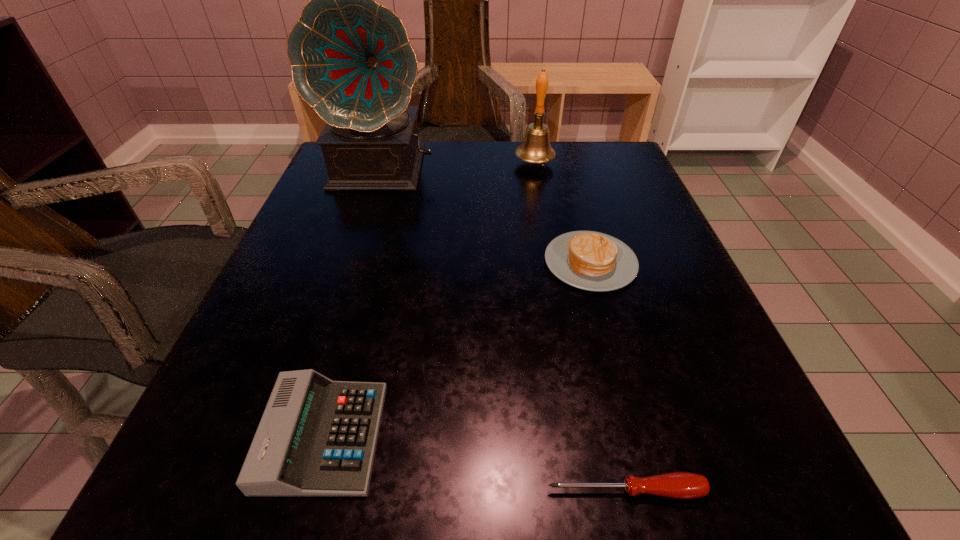
Identify the location of vacant area that lies between the screwdriver and the calculator. (474, 463).

You are a GUI agent. You are given a task and a screenshot of the screen. Output one action in this format:
    pyautogui.click(x=<x>, y=<y>)
    Task: Click on the vacant area that lies between the pancake and the bell
    This screenshot has width=960, height=540.
    Given the screenshot: What is the action you would take?
    pyautogui.click(x=563, y=213)

At what (x,y) coordinates should I click in order to perform the action: click on free spot between the shortest object and the third farthest object. Please return your answer as a coordinate pair (x, y). The width and height of the screenshot is (960, 540). Looking at the image, I should click on (608, 376).

What are the coordinates of `empty space that is in between the shortest object and the calculator` in the screenshot? It's located at (474, 463).

Find the location of `free area in between the screwdriver and the third nearest object`. free area in between the screwdriver and the third nearest object is located at coordinates (608, 376).

In order to click on vacant area that lies between the bell and the pancake in this screenshot , I will do click(563, 213).

Where is `free spot between the calculator and the bell`? Image resolution: width=960 pixels, height=540 pixels. free spot between the calculator and the bell is located at coordinates (429, 300).

Locate an element on the screen. The height and width of the screenshot is (540, 960). the second closest object relative to the calculator is located at coordinates (588, 260).

Find the location of a particular element. The height and width of the screenshot is (540, 960). object that is the closest to the screwdriver is located at coordinates (317, 437).

Where is `free space that satisfies the following two spatial constraints: 1. on the horn of the record player; 2. on the left side of the third nearest object`? The image size is (960, 540). free space that satisfies the following two spatial constraints: 1. on the horn of the record player; 2. on the left side of the third nearest object is located at coordinates (355, 262).